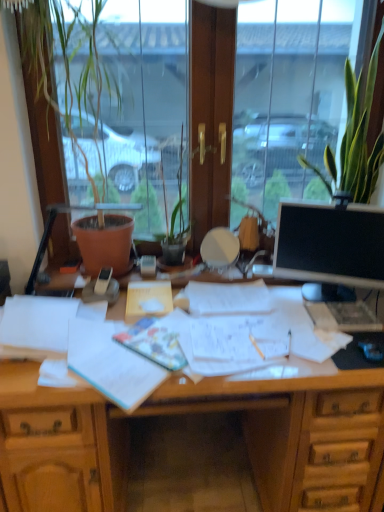
Measure the distance between point (111, 487) and camera.

Point (111, 487) is 1.46 meters away from camera.

Consider the image. In order to face wooden desk at center, should I rotate leftwards or rightwards?

A 0.014 degree turn to the right will do.

The width and height of the screenshot is (384, 512). Describe the element at coordinates (111, 364) in the screenshot. I see `light blue paper at center, the second document from the back` at that location.

What is the approximate height of terracotta pot at left?

3.33 feet.

At what (x,y) coordinates should I click in order to perform the action: click on wooden desk at center. Please return your answer as a coordinate pair (x, y). The width and height of the screenshot is (384, 512). Looking at the image, I should click on (191, 412).

From the image's perspective, is transparent glass window at center above black glossy monitor at right?

Indeed, from the image's perspective, transparent glass window at center is shown above black glossy monitor at right.

Considering the points (39, 150) and (329, 236), which point is in front, point (39, 150) or point (329, 236)?

The point (329, 236) is closer to the camera.

Is transparent glass window at center facing away from black glossy monitor at right?

That's right, transparent glass window at center is facing away from black glossy monitor at right.

Is transparent glass window at center far from black glossy monitor at right?

Yes, transparent glass window at center and black glossy monitor at right are quite far apart.

Would you say terracotta pot at left is outside white paper at center, placed as the first document when sorted from top to bottom?

terracotta pot at left is positioned outside white paper at center, placed as the first document when sorted from top to bottom.

Between terracotta pot at left and white paper at center, the first document when ordered from back to front, which one has larger size?

terracotta pot at left.

From a real-world perspective, is terracotta pot at left physically located above or below white paper at center, the second document when ordered from bottom to top?

terracotta pot at left is above white paper at center, the second document when ordered from bottom to top.

Is terracotta pot at left not close to white paper at center, placed as the first document when sorted from top to bottom?

They are positioned close to each other.

From the picture: Can we say white paper at center, placed as the first document when sorted from top to bottom, lies outside green leafy plant at upper right?

Absolutely, white paper at center, placed as the first document when sorted from top to bottom, is external to green leafy plant at upper right.

Can you confirm if white paper at center, the second document when ordered from bottom to top, is positioned to the right of green leafy plant at upper right?

No, white paper at center, the second document when ordered from bottom to top, is not to the right of green leafy plant at upper right.

Is white paper at center, placed as the first document when sorted from top to bottom, taller or shorter than green leafy plant at upper right?

Considering their sizes, white paper at center, placed as the first document when sorted from top to bottom, has less height than green leafy plant at upper right.

Considering the positions of objects white paper at center, placed as the first document when sorted from top to bottom, and green leafy plant at upper right in the image provided, who is in front, white paper at center, placed as the first document when sorted from top to bottom, or green leafy plant at upper right?

green leafy plant at upper right is closer to the camera.

In order to click on document that is the 1st object directly below the transparent glass window at center (from a real-world perspective) in this screenshot , I will do `click(111, 364)`.

From a real-world perspective, is transparent glass window at center positioned above or below light blue paper at center, which appears as the 1th document when viewed from the front?

transparent glass window at center is above light blue paper at center, which appears as the 1th document when viewed from the front.

Is transparent glass window at center closer to camera compared to light blue paper at center, which appears as the 1th document when viewed from the front?

No, transparent glass window at center is further to the viewer.

How many degrees apart are the facing directions of transparent glass window at center and light blue paper at center, which is the second document in top-to-bottom order?

The angle between the facing direction of transparent glass window at center and the facing direction of light blue paper at center, which is the second document in top-to-bottom order, is 41.7 degrees.

From the picture: Can you confirm if matte black phone at center is positioned to the right of transparent glass window at center?

In fact, matte black phone at center is to the left of transparent glass window at center.

From a real-world perspective, which object rests below the other?

In real-world perspective, matte black phone at center is lower.

Identify the location of mobile phone located underneath the transparent glass window at center (from a real-world perspective). The image size is (384, 512). (103, 280).

Does point (99, 281) lie in front of point (42, 213)?

That is True.

Considering the positions of objects green leafy plant at upper right and light blue paper at center, which appears as the 1th document when viewed from the front, in the image provided, who is more to the right, green leafy plant at upper right or light blue paper at center, which appears as the 1th document when viewed from the front,?

Positioned to the right is green leafy plant at upper right.

In the image, is green leafy plant at upper right positioned in front of or behind light blue paper at center, the second document from the back?

Visually, green leafy plant at upper right is located behind light blue paper at center, the second document from the back.

Is point (356, 199) behind point (114, 354)?

Yes.

Where is `houseplant that appears above the light blue paper at center, the second document from the back (from a real-world perspective)`? houseplant that appears above the light blue paper at center, the second document from the back (from a real-world perspective) is located at coordinates point(358,137).

In the scene shown: Is green leafy plant at upper right positioned with its back to terracotta pot at left?

No.

Which is further, (375, 183) or (97, 134)?

Point (375, 183)

Between green leafy plant at upper right and terracotta pot at left, which one has larger width?

With larger width is terracotta pot at left.

Consider the image. Is green leafy plant at upper right next to terracotta pot at left and touching it?

green leafy plant at upper right is not next to terracotta pot at left, and they're not touching.

Where is `television below the transparent glass window at center (from a real-world perspective)`? The height and width of the screenshot is (512, 384). television below the transparent glass window at center (from a real-world perspective) is located at coordinates (330, 245).

Locate an element on the screen. plant above the white paper at center, which is the 2th document in front-to-back order (from a real-world perspective) is located at coordinates (66, 64).

Considering their positions, is light blue paper at center, which is the second document in top-to-bottom order, positioned closer to green leafy plant at upper right than black glossy monitor at right?

The object closer to green leafy plant at upper right is black glossy monitor at right.

Looking at the image, which one is located further to matte black phone at center, wooden desk at center or terracotta pot at left?

Among the two, wooden desk at center is located further to matte black phone at center.

Consider the image. Based on their spatial positions, is black glossy monitor at right or white paper at center, which is the 2th document in front-to-back order, closer to green leafy plant at upper right?

The object closer to green leafy plant at upper right is black glossy monitor at right.

Estimate the real-world distances between objects in this image. Which object is closer to light blue paper at center, the second document from the back, white paper at center, placed as the first document when sorted from top to bottom, or transparent glass window at center?

The object closer to light blue paper at center, the second document from the back, is white paper at center, placed as the first document when sorted from top to bottom.

From the image, which object appears to be nearer to wooden desk at center, terracotta pot at left or matte black phone at center?

Based on the image, matte black phone at center appears to be nearer to wooden desk at center.

Which object lies nearer to the anchor point terracotta pot at left, transparent glass window at center or white paper at center, the first document when ordered from back to front?

Based on the image, transparent glass window at center appears to be nearer to terracotta pot at left.

From the image, which object appears to be farther from green leafy plant at upper right, matte black phone at center or terracotta pot at left?

matte black phone at center is further to green leafy plant at upper right.

Looking at the image, which one is located further to wooden desk at center, white paper at center, the first document when ordered from back to front, or black glossy monitor at right?

black glossy monitor at right is further to wooden desk at center.

Locate an element on the screen. This screenshot has width=384, height=512. mobile phone situated between terracotta pot at left and green leafy plant at upper right from left to right is located at coordinates (103, 280).

Locate an element on the screen. This screenshot has width=384, height=512. plant between transparent glass window at center and white paper at center, the second document when ordered from bottom to top, in the up-down direction is located at coordinates (66, 64).

This screenshot has width=384, height=512. In order to click on document between terracotta pot at left and light blue paper at center, which appears as the 1th document when viewed from the front, vertically in this screenshot , I will do `click(148, 298)`.

Locate an element on the screen. The height and width of the screenshot is (512, 384). desk between light blue paper at center, which is the second document in top-to-bottom order, and matte black phone at center, along the z-axis is located at coordinates (191, 412).